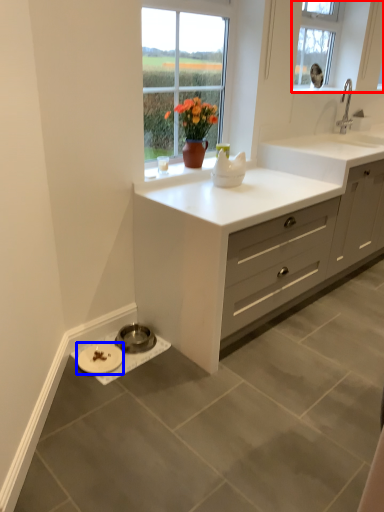
Question: Which point is further to the camera, window (highlighted by a red box) or platter (highlighted by a blue box)?

Choices:
 (A) window
 (B) platter

Answer: (A)